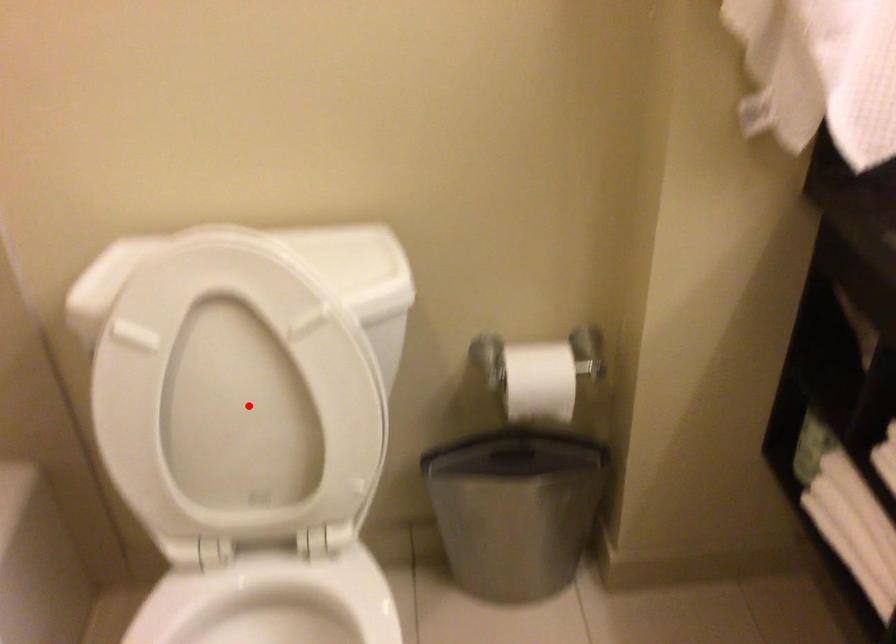
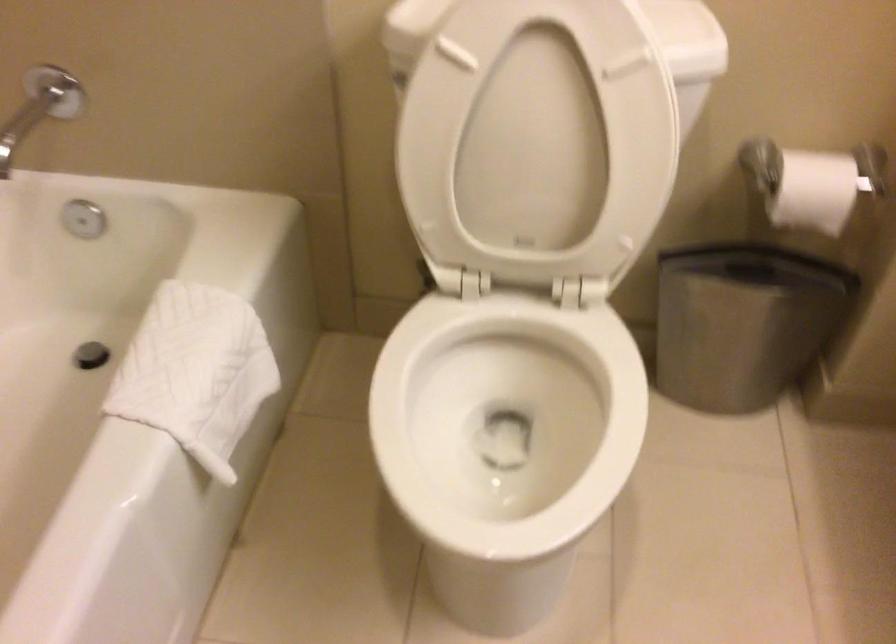
In the second image, find the point that corresponds to the highlighted location in the first image.

(538, 140)